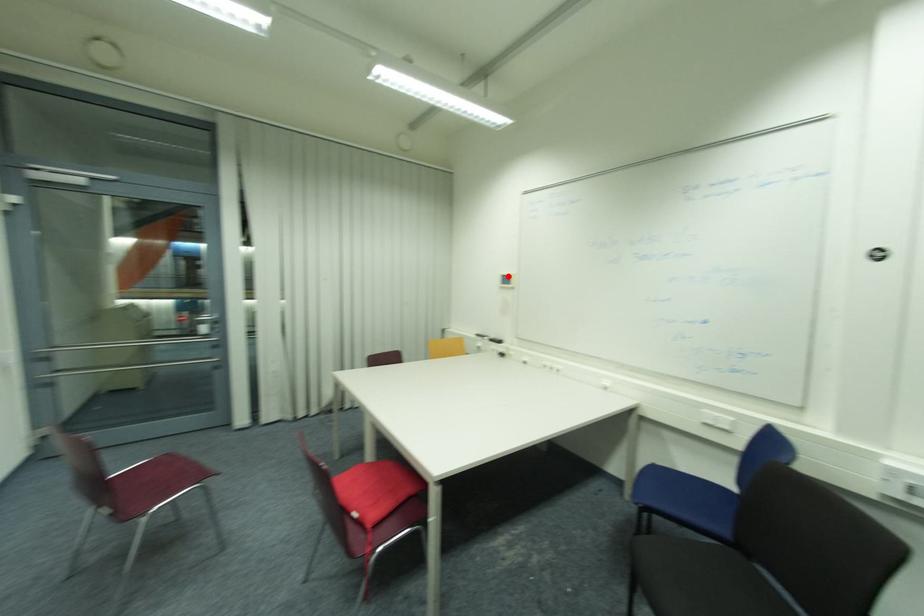
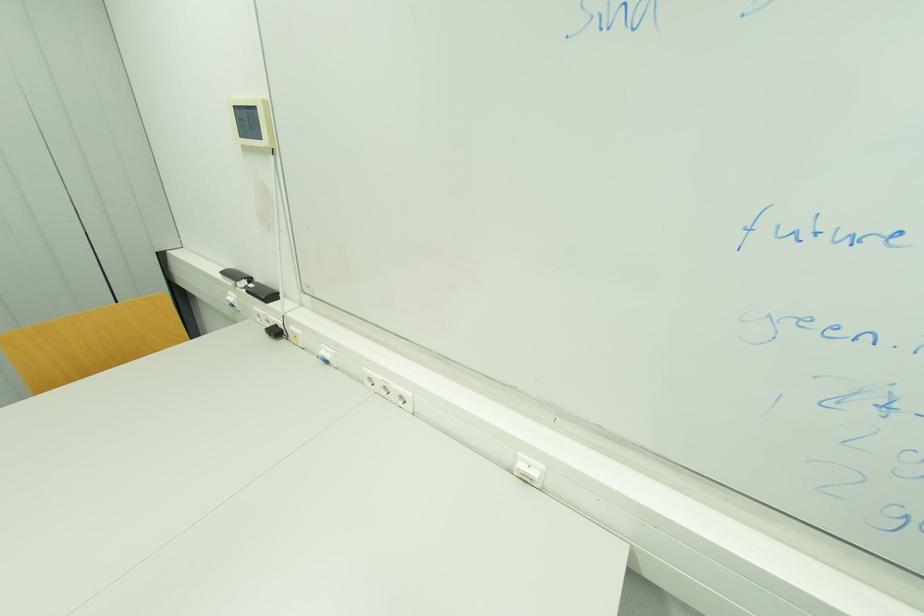
The point at the highlighted location is marked in the first image. Where is the corresponding point in the second image?

(237, 108)